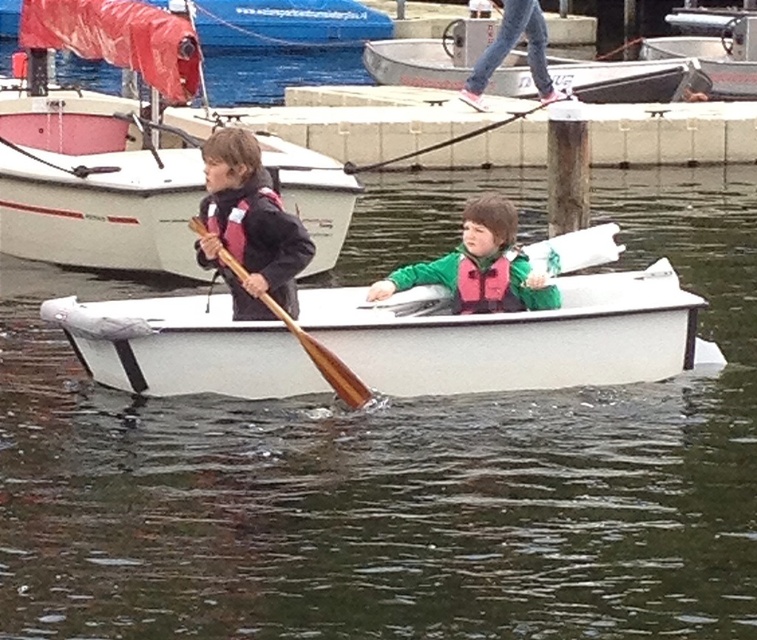
Question: Can you confirm if white plastic canoe at center is positioned to the left of green matte life vest at center?

Choices:
 (A) no
 (B) yes

Answer: (B)

Question: Does white plastic boat at center appear on the left side of matte black life vest at left?

Choices:
 (A) yes
 (B) no

Answer: (A)

Question: Which of the following is the closest to the observer?

Choices:
 (A) white plastic canoe at center
 (B) wooden paddle at center
 (C) white smooth water at center

Answer: (C)

Question: Does white smooth water at center have a smaller size compared to white plastic canoe at center?

Choices:
 (A) yes
 (B) no

Answer: (B)

Question: Which of the following is the closest to the observer?

Choices:
 (A) white plastic boat at center
 (B) white plastic canoe at center
 (C) pink fabric life jacket at left
 (D) white smooth water at center

Answer: (D)

Question: Which of the following is the farthest from the observer?

Choices:
 (A) white plastic canoe at center
 (B) pink fabric life jacket at left

Answer: (B)